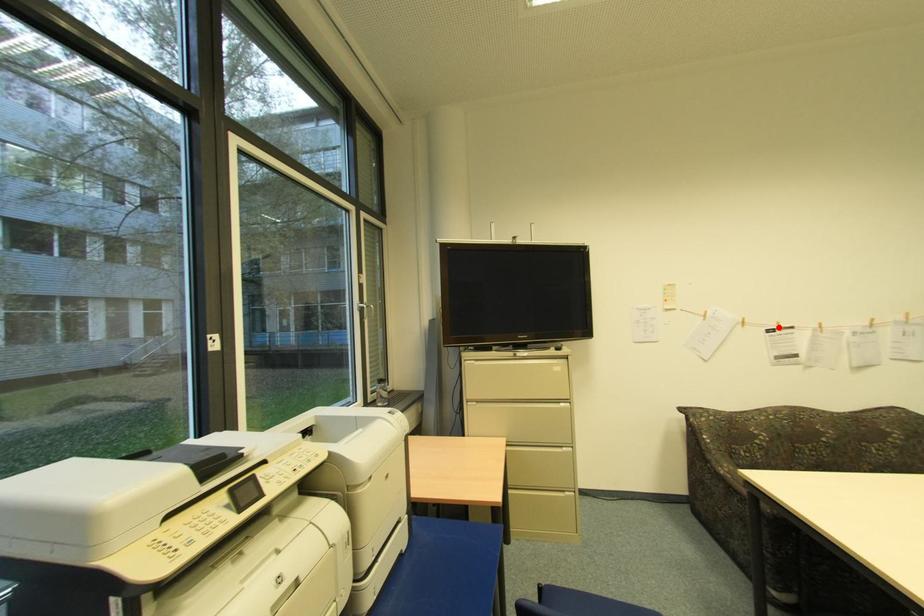
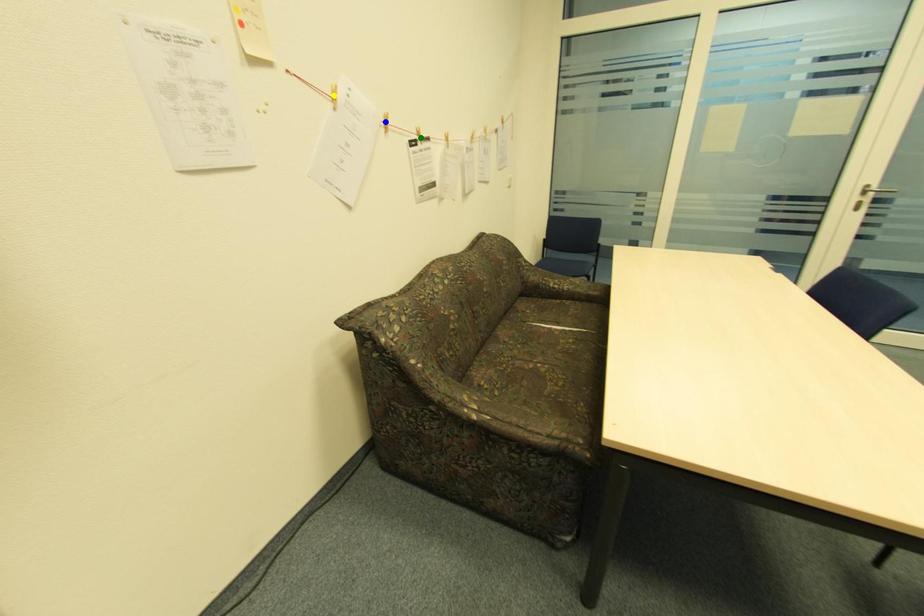
Question: I am providing you with two images of the same scene from different viewpoints. A red point is marked on the first image. You are given multiple points on the second image. Which mark in image 2 goes with the point in image 1?

Choices:
 (A) blue point
 (B) yellow point
 (C) green point

Answer: (C)